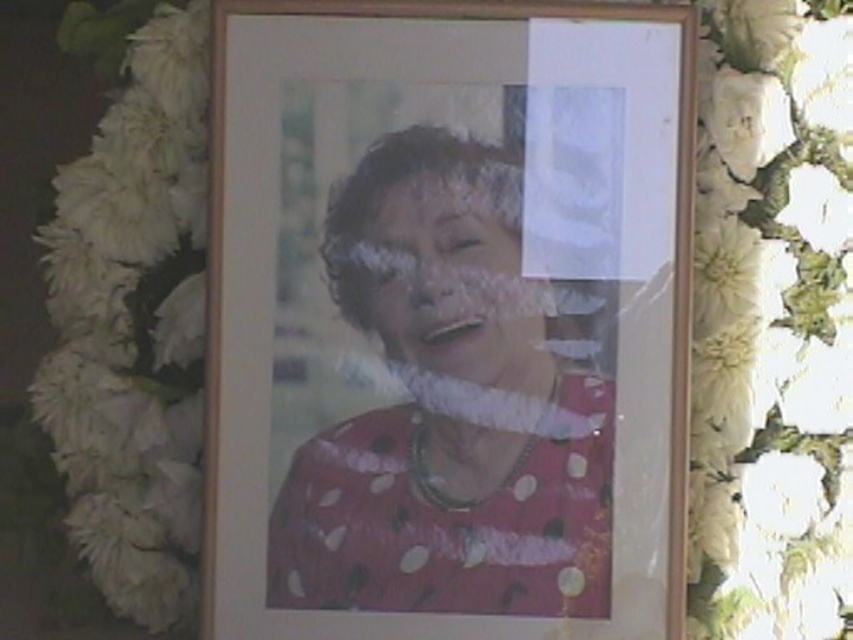
You are a photographer trying to capture a closeup of the wooden picture frame at center and the white fluffy petals at left. Your camera can focus on objects within a 10 inch range. Can you focus on both objects at the same time?

The wooden picture frame at center is 12.54 inches away from the white fluffy petals at left, so the distance between them is greater than the camera focus range of 10 inches. Therefore, you cannot focus on both objects simultaneously.

You are standing in front of the framed photograph of the elderly woman. There are two points marked on the image at coordinates point (416,292) and point (157,550). Which point is closer to you?

Point (416,292) is in front of point (157,550), so it is closer to you.